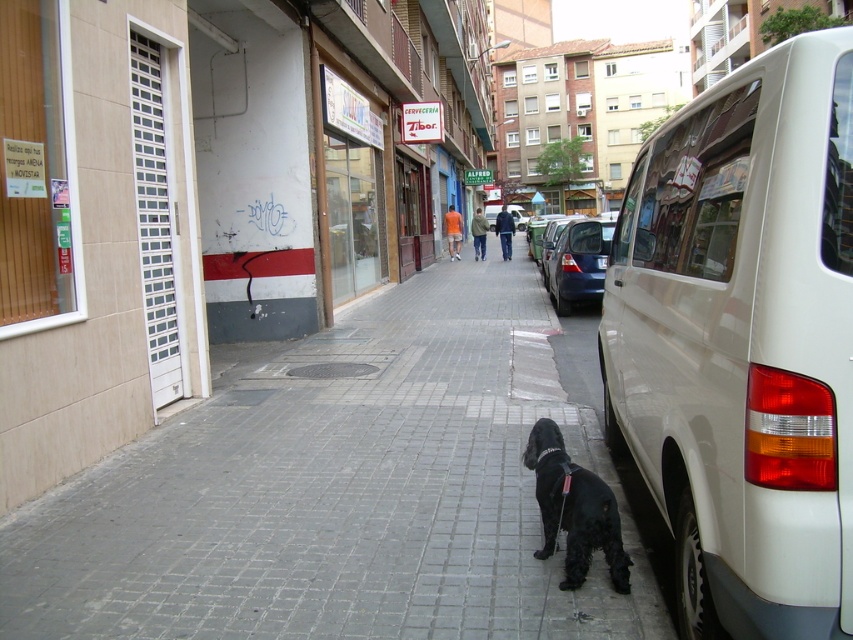
Question: Which object is positioned closest to the black plastic van at right?

Choices:
 (A) black plastic license plate at right
 (B) shiny black dog at center

Answer: (A)

Question: Can you confirm if shiny black dog at center is smaller than black plastic license plate at right?

Choices:
 (A) yes
 (B) no

Answer: (B)

Question: Is shiny black dog at center smaller than black plastic van at right?

Choices:
 (A) no
 (B) yes

Answer: (A)

Question: Which object appears farthest from the camera in this image?

Choices:
 (A) shiny black dog at center
 (B) black plastic license plate at right
 (C) gray brick pavement at center

Answer: (B)

Question: Which point appears closest to the camera in this image?

Choices:
 (A) (206, 621)
 (B) (595, 497)
 (C) (572, 259)
 (D) (601, 262)

Answer: (A)

Question: Observing the image, what is the correct spatial positioning of gray brick pavement at center in reference to white glossy van at right?

Choices:
 (A) above
 (B) below

Answer: (B)